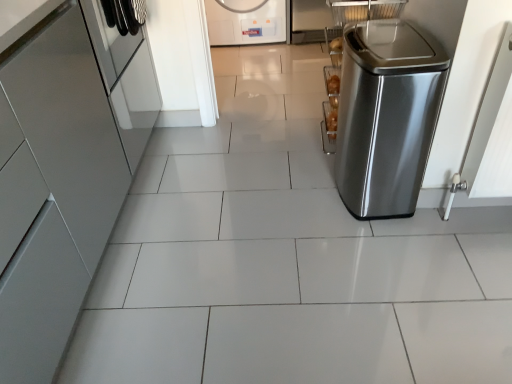
Question: Is stainless steel trash can at right, which appears as the first home appliance when viewed from the right, inside the boundaries of glossy metallic cabinet at left, positioned as the first home appliance in left-to-right order, or outside?

Choices:
 (A) outside
 (B) inside

Answer: (A)

Question: In the image, is stainless steel trash can at right, which appears as the first home appliance when viewed from the right, on the left side or the right side of glossy metallic cabinet at left, positioned as the first home appliance in left-to-right order?

Choices:
 (A) left
 (B) right

Answer: (B)

Question: Considering the real-world distances, which object is farthest from the white glossy washing machine at upper center, positioned as the 1th home appliance in back-to-front order?

Choices:
 (A) glossy metallic cabinet at left, marked as the 3th home appliance in a right-to-left arrangement
 (B) stainless steel trash can at right, the first home appliance positioned from the front

Answer: (A)

Question: Which object is the closest to the glossy metallic cabinet at left, the 2th home appliance when ordered from front to back?

Choices:
 (A) white glossy washing machine at upper center, the 3th home appliance viewed from the front
 (B) stainless steel trash can at right, the first home appliance positioned from the front

Answer: (B)